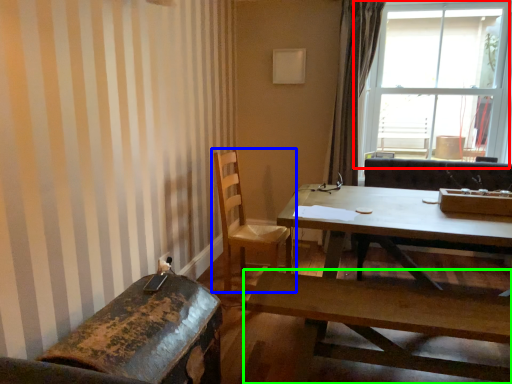
Question: Which object is the farthest from window (highlighted by a red box)? Choose among these: chair (highlighted by a blue box) or coffee table (highlighted by a green box).

Choices:
 (A) chair
 (B) coffee table

Answer: (B)